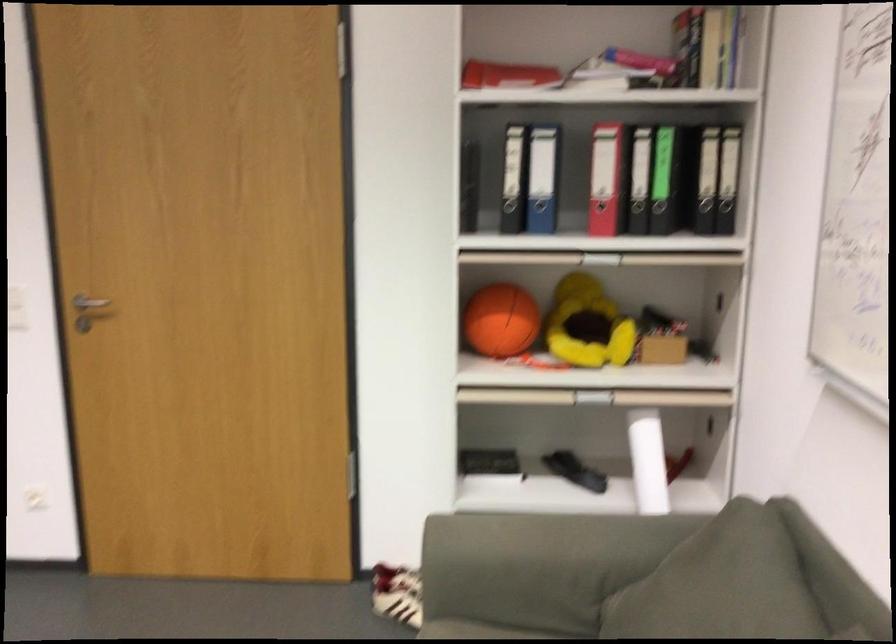
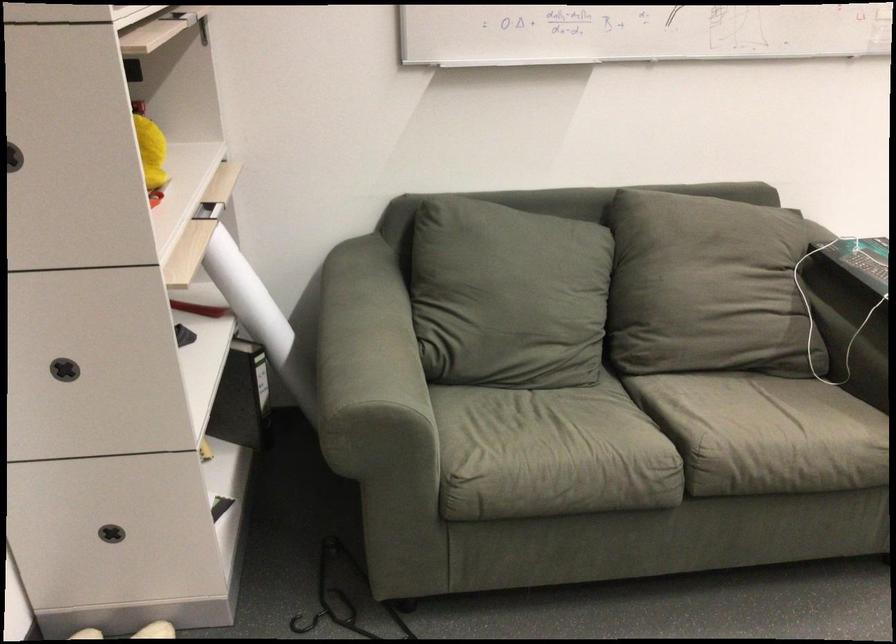
Question: I am providing you with two images of the same scene from different viewpoints. After the viewpoint changes to image2, which objects are now occluded?

Choices:
 (A) wooden handrail
 (B) white rolled paper
 (C) yellow yarn ball
 (D) grey sofa pillow

Answer: (B)